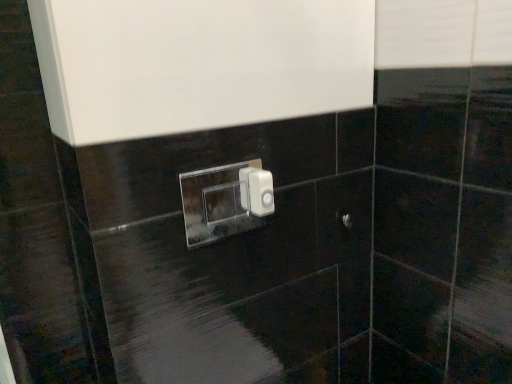
How much space does white plastic light switch at center, arranged as the first light switch when viewed from the right, occupy horizontally?

white plastic light switch at center, arranged as the first light switch when viewed from the right, is 2.13 inches wide.

Where is `transparent acrylic light switch at center, which is the 2th light switch from right to left`? The image size is (512, 384). transparent acrylic light switch at center, which is the 2th light switch from right to left is located at coordinates (225, 201).

Considering the positions of points (256, 193) and (254, 211), is point (256, 193) closer to camera compared to point (254, 211)?

Yes, it is.

Is transparent acrylic light switch at center, the first light switch in the left-to-right sequence, positioned in front of white plastic light switch at center, arranged as the first light switch when viewed from the right?

Yes, transparent acrylic light switch at center, the first light switch in the left-to-right sequence, is in front of white plastic light switch at center, arranged as the first light switch when viewed from the right.

In the scene shown: Would you say white plastic light switch at center, arranged as the first light switch when viewed from the right, is part of transparent acrylic light switch at center, which is the 2th light switch from right to left,'s contents?

No, white plastic light switch at center, arranged as the first light switch when viewed from the right, is not a part of transparent acrylic light switch at center, which is the 2th light switch from right to left.

Is transparent acrylic light switch at center, which is the 2th light switch from right to left, oriented away from white plastic light switch at center, which ranks as the 2th light switch in left-to-right order?

Yes, transparent acrylic light switch at center, which is the 2th light switch from right to left, is facing away from white plastic light switch at center, which ranks as the 2th light switch in left-to-right order.

Considering the sizes of objects satin nickel door handle at center and white plastic light switch at center, arranged as the first light switch when viewed from the right, in the image provided, who is thinner, satin nickel door handle at center or white plastic light switch at center, arranged as the first light switch when viewed from the right,?

satin nickel door handle at center.

Is the surface of satin nickel door handle at center in direct contact with white plastic light switch at center, arranged as the first light switch when viewed from the right?

No, satin nickel door handle at center is not touching white plastic light switch at center, arranged as the first light switch when viewed from the right.

From the image's perspective, which one is positioned higher, satin nickel door handle at center or white plastic light switch at center, which ranks as the 2th light switch in left-to-right order?

white plastic light switch at center, which ranks as the 2th light switch in left-to-right order.

From a real-world perspective, is white plastic light switch at center, which ranks as the 2th light switch in left-to-right order, over satin nickel door handle at center?

Indeed, from a real-world perspective, white plastic light switch at center, which ranks as the 2th light switch in left-to-right order, stands above satin nickel door handle at center.

Which is less distant, (273, 192) or (351, 227)?

Point (273, 192) appears to be closer to the viewer than point (351, 227).

Does white plastic light switch at center, which ranks as the 2th light switch in left-to-right order, have a lesser height compared to satin nickel door handle at center?

No, white plastic light switch at center, which ranks as the 2th light switch in left-to-right order, is not shorter than satin nickel door handle at center.

In the scene shown: Would you say white plastic light switch at center, which ranks as the 2th light switch in left-to-right order, is to the left or to the right of satin nickel door handle at center in the picture?

In the image, white plastic light switch at center, which ranks as the 2th light switch in left-to-right order, appears on the left side of satin nickel door handle at center.

At what (x,y) coordinates should I click in order to perform the action: click on door handle directly beneath the transparent acrylic light switch at center, which is the 2th light switch from right to left (from a real-world perspective). Please return your answer as a coordinate pair (x, y). Looking at the image, I should click on (344, 219).

Is transparent acrylic light switch at center, the first light switch in the left-to-right sequence, shorter than satin nickel door handle at center?

No, transparent acrylic light switch at center, the first light switch in the left-to-right sequence, is not shorter than satin nickel door handle at center.

Is transparent acrylic light switch at center, the first light switch in the left-to-right sequence, facing away from satin nickel door handle at center?

No, transparent acrylic light switch at center, the first light switch in the left-to-right sequence, is not facing away from satin nickel door handle at center.

From the image's perspective, between transparent acrylic light switch at center, which is the 2th light switch from right to left, and satin nickel door handle at center, which one is located above?

From the image's view, transparent acrylic light switch at center, which is the 2th light switch from right to left, is above.

Is satin nickel door handle at center oriented towards transparent acrylic light switch at center, which is the 2th light switch from right to left?

No, satin nickel door handle at center does not turn towards transparent acrylic light switch at center, which is the 2th light switch from right to left.

At what (x,y) coordinates should I click in order to perform the action: click on door handle lying behind the transparent acrylic light switch at center, the first light switch in the left-to-right sequence. Please return your answer as a coordinate pair (x, y). The height and width of the screenshot is (384, 512). Looking at the image, I should click on (344, 219).

Between satin nickel door handle at center and transparent acrylic light switch at center, which is the 2th light switch from right to left, which one appears on the left side from the viewer's perspective?

transparent acrylic light switch at center, which is the 2th light switch from right to left.

From a real-world perspective, who is located higher, satin nickel door handle at center or transparent acrylic light switch at center, which is the 2th light switch from right to left?

From a 3D spatial view, transparent acrylic light switch at center, which is the 2th light switch from right to left, is above.

From the image's perspective, which is above, white plastic light switch at center, arranged as the first light switch when viewed from the right, or transparent acrylic light switch at center, which is the 2th light switch from right to left?

white plastic light switch at center, arranged as the first light switch when viewed from the right, appears higher in the image.

Looking at this image, which object is further away from the camera, white plastic light switch at center, arranged as the first light switch when viewed from the right, or transparent acrylic light switch at center, which is the 2th light switch from right to left?

white plastic light switch at center, arranged as the first light switch when viewed from the right, is behind.

Looking at their sizes, would you say white plastic light switch at center, arranged as the first light switch when viewed from the right, is wider or thinner than transparent acrylic light switch at center, the first light switch in the left-to-right sequence?

In the image, white plastic light switch at center, arranged as the first light switch when viewed from the right, appears to be wider than transparent acrylic light switch at center, the first light switch in the left-to-right sequence.

Considering the points (260, 213) and (244, 165), which point is behind, point (260, 213) or point (244, 165)?

The point (244, 165) is farther from the camera.

You are a GUI agent. You are given a task and a screenshot of the screen. Output one action in this format:
    pyautogui.click(x=<x>, y=<y>)
    Task: Click on the light switch that appears on the left of white plastic light switch at center, which ranks as the 2th light switch in left-to-right order
    This screenshot has width=512, height=384.
    Given the screenshot: What is the action you would take?
    pyautogui.click(x=225, y=201)

The image size is (512, 384). In order to click on door handle behind the white plastic light switch at center, arranged as the first light switch when viewed from the right in this screenshot , I will do `click(344, 219)`.

Consider the image. Considering their positions, is white plastic light switch at center, which ranks as the 2th light switch in left-to-right order, positioned further to satin nickel door handle at center than transparent acrylic light switch at center, which is the 2th light switch from right to left?

transparent acrylic light switch at center, which is the 2th light switch from right to left, is positioned further to the anchor satin nickel door handle at center.

From the image, which object appears to be farther from transparent acrylic light switch at center, the first light switch in the left-to-right sequence, satin nickel door handle at center or white plastic light switch at center, arranged as the first light switch when viewed from the right?

Based on the image, white plastic light switch at center, arranged as the first light switch when viewed from the right, appears to be further to transparent acrylic light switch at center, the first light switch in the left-to-right sequence.

Considering their positions, is white plastic light switch at center, arranged as the first light switch when viewed from the right, positioned closer to transparent acrylic light switch at center, the first light switch in the left-to-right sequence, than satin nickel door handle at center?

satin nickel door handle at center is positioned closer to the anchor transparent acrylic light switch at center, the first light switch in the left-to-right sequence.

Which object lies nearer to the anchor point white plastic light switch at center, arranged as the first light switch when viewed from the right, satin nickel door handle at center or transparent acrylic light switch at center, the first light switch in the left-to-right sequence?

Based on the image, satin nickel door handle at center appears to be nearer to white plastic light switch at center, arranged as the first light switch when viewed from the right.

Which object lies nearer to the anchor point white plastic light switch at center, which ranks as the 2th light switch in left-to-right order, transparent acrylic light switch at center, the first light switch in the left-to-right sequence, or satin nickel door handle at center?

Among the two, satin nickel door handle at center is located nearer to white plastic light switch at center, which ranks as the 2th light switch in left-to-right order.

Considering their positions, is transparent acrylic light switch at center, the first light switch in the left-to-right sequence, positioned further to satin nickel door handle at center than white plastic light switch at center, arranged as the first light switch when viewed from the right?

transparent acrylic light switch at center, the first light switch in the left-to-right sequence.

This screenshot has width=512, height=384. What are the coordinates of `light switch between transparent acrylic light switch at center, the first light switch in the left-to-right sequence, and satin nickel door handle at center from left to right` in the screenshot? It's located at (x=260, y=193).